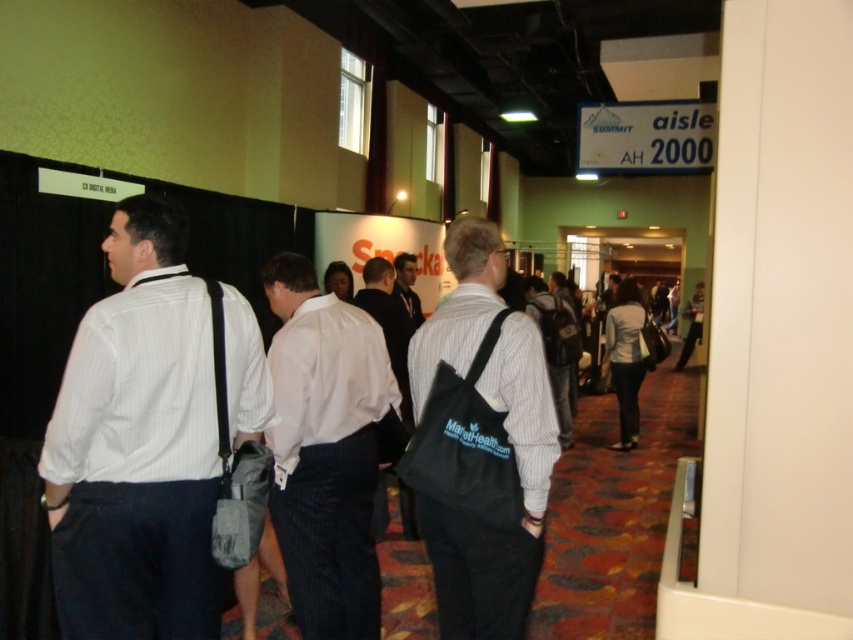
Question: Which of these objects is positioned farthest from the white pinstripe shirt at center?

Choices:
 (A) light brown leather jacket at center
 (B) black fabric bag at center
 (C) dark gray suit at center
 (D) striped shirt at center

Answer: (D)

Question: Is white striped shirt at center wider than dark gray suit at center?

Choices:
 (A) no
 (B) yes

Answer: (B)

Question: Which point appears farthest from the camera in this image?

Choices:
 (A) (100, 374)
 (B) (560, 390)
 (C) (410, 256)
 (D) (480, 504)

Answer: (B)

Question: Is dark gray suit at center thinner than striped shirt at center?

Choices:
 (A) yes
 (B) no

Answer: (A)

Question: Which point appears farthest from the camera in this image?

Choices:
 (A) (310, 524)
 (B) (410, 326)
 (C) (173, 422)
 (D) (408, 294)

Answer: (D)

Question: Observing the image, what is the correct spatial positioning of white pinstripe shirt at center in reference to striped shirt at center?

Choices:
 (A) left
 (B) right

Answer: (A)